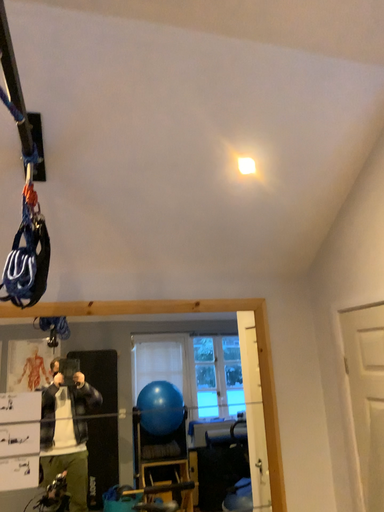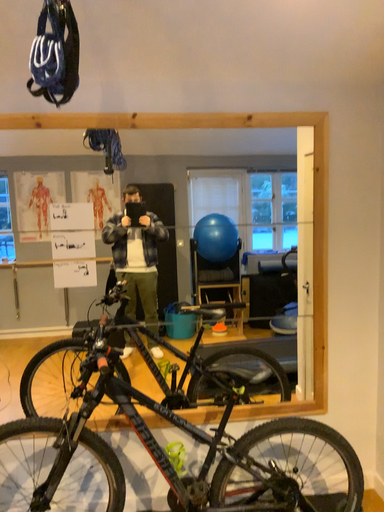
Question: Which way did the camera rotate in the video?

Choices:
 (A) rotated right
 (B) rotated left

Answer: (B)